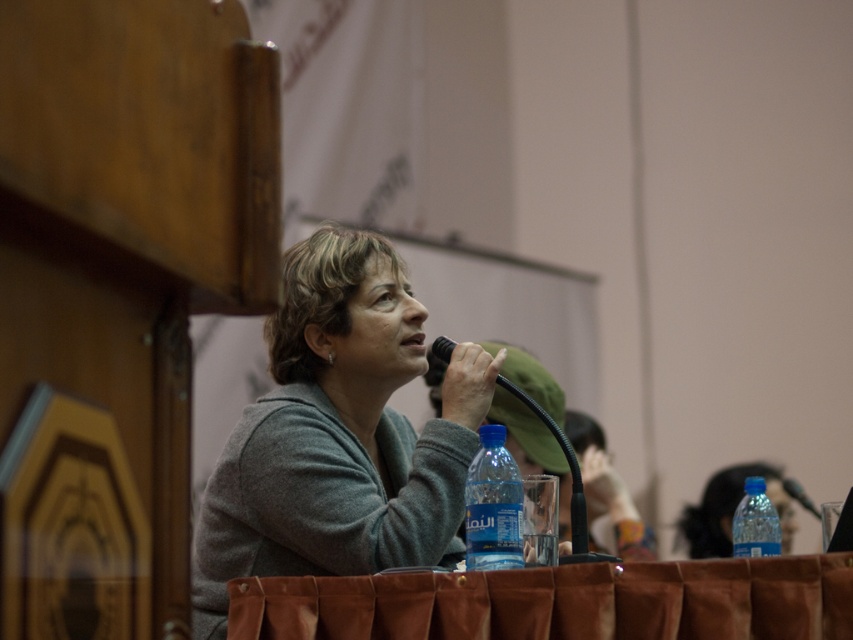
Can you confirm if gray matte sweater at center is smaller than transparent plastic bottle at lower right?

Incorrect, gray matte sweater at center is not smaller in size than transparent plastic bottle at lower right.

Between gray matte sweater at center and transparent plastic bottle at lower right, which one is positioned higher?

gray matte sweater at center is above.

Does point (250, 547) come in front of point (677, 532)?

Yes, it is in front of point (677, 532).

This screenshot has width=853, height=640. I want to click on gray matte sweater at center, so pyautogui.click(x=338, y=435).

Is point (633, 588) farther from viewer compared to point (744, 516)?

No, (633, 588) is closer to viewer.

Does brown velvet table at center have a lesser width compared to blue plastic bottle at lower right?

In fact, brown velvet table at center might be wider than blue plastic bottle at lower right.

Is point (822, 614) more distant than point (763, 484)?

No, it is not.

Find the location of a particular element. The height and width of the screenshot is (640, 853). brown velvet table at center is located at coordinates (560, 602).

The width and height of the screenshot is (853, 640). Describe the element at coordinates (733, 508) in the screenshot. I see `transparent plastic bottle at lower right` at that location.

Between point (807, 502) and point (784, 486), which one is positioned in front?

Point (807, 502) is in front.

Locate an element on the screen. The height and width of the screenshot is (640, 853). transparent plastic bottle at lower right is located at coordinates (733, 508).